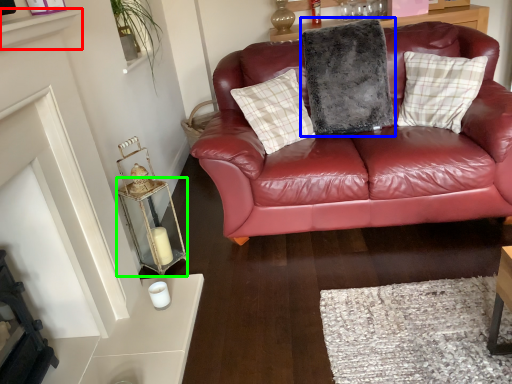
Question: Which object is the closest to the shelf (highlighted by a red box)? Choose among these: pillow (highlighted by a blue box) or table (highlighted by a green box).

Choices:
 (A) pillow
 (B) table

Answer: (B)